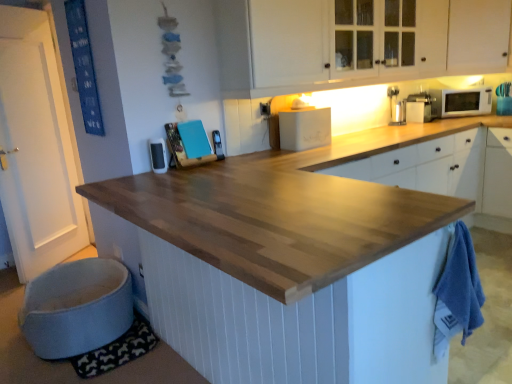
You are a GUI agent. You are given a task and a screenshot of the screen. Output one action in this format:
    pyautogui.click(x=<x>, y=<y>)
    Task: Click on the natural wood countertop at center
    This screenshot has height=384, width=512.
    Given the screenshot: What is the action you would take?
    pyautogui.click(x=286, y=264)

This screenshot has height=384, width=512. Identify the location of white matte cabinet at upper right, which is the first cabinetry in right-to-left order. (478, 36).

This screenshot has width=512, height=384. Describe the element at coordinates (478, 36) in the screenshot. I see `white matte cabinet at upper right, which is the first cabinetry in right-to-left order` at that location.

The height and width of the screenshot is (384, 512). Describe the element at coordinates (305, 128) in the screenshot. I see `white matte breadbox at upper center, marked as the 3th appliance in a left-to-right arrangement` at that location.

The height and width of the screenshot is (384, 512). In order to click on white glossy microwave at upper center, which ranks as the fourth appliance in back-to-front order in this screenshot , I will do `click(158, 155)`.

Measure the distance between point (165, 146) and camera.

Point (165, 146) is 7.57 feet from camera.

I want to click on white glossy microwave at upper right, so click(x=460, y=102).

Is white matte cabinet at upper right, which appears as the second cabinetry when viewed from the left, wider than natural wood countertop at center?

No.

How far apart are white matte cabinet at upper right, which is the first cabinetry in right-to-left order, and natural wood countertop at center?

white matte cabinet at upper right, which is the first cabinetry in right-to-left order, and natural wood countertop at center are 6.78 feet apart from each other.

Is white matte cabinet at upper right, which is the first cabinetry in right-to-left order, positioned with its back to natural wood countertop at center?

No.

From the image's perspective, is white matte cabinet at upper right, which is the first cabinetry in right-to-left order, on top of natural wood countertop at center?

Yes, from the image's perspective, white matte cabinet at upper right, which is the first cabinetry in right-to-left order, is above natural wood countertop at center.

Based on the photo, is metallic silver phone at center, the 2th appliance positioned from the front, oriented away from white glossy microwave at upper center, which is counted as the fourth appliance, starting from the right?

No.

From a real-world perspective, which is physically below, metallic silver phone at center, which is the 3th appliance from right to left, or white glossy microwave at upper center, the first appliance in the left-to-right sequence?

In real-world perspective, metallic silver phone at center, which is the 3th appliance from right to left, is lower.

Considering the relative sizes of metallic silver phone at center, the 2th appliance positioned from the front, and white glossy microwave at upper center, which is counted as the fourth appliance, starting from the right, in the image provided, is metallic silver phone at center, the 2th appliance positioned from the front, wider than white glossy microwave at upper center, which is counted as the fourth appliance, starting from the right,?

Yes, metallic silver phone at center, the 2th appliance positioned from the front, is wider than white glossy microwave at upper center, which is counted as the fourth appliance, starting from the right.

Which of these two, metallic silver phone at center, which is the 3th appliance from right to left, or white glossy microwave at upper center, the first appliance in the left-to-right sequence, stands taller?

white glossy microwave at upper center, the first appliance in the left-to-right sequence.

At what (x,y) coordinates should I click in order to perform the action: click on microwave oven located above the white glossy microwave at upper right, which is the first appliance in right-to-left order (from a real-world perspective). Please return your answer as a coordinate pair (x, y). Looking at the image, I should click on (460, 102).

Is white glossy microwave at upper right in contact with white glossy microwave at upper right, the fourth appliance viewed from the front?

white glossy microwave at upper right is not next to white glossy microwave at upper right, the fourth appliance viewed from the front, and they're not touching.

Between white glossy microwave at upper right and white glossy microwave at upper right, marked as the 4th appliance in a left-to-right arrangement, which one appears on the right side from the viewer's perspective?

white glossy microwave at upper right.

Could you tell me if white wood cabinets at upper center, which ranks as the second cabinetry in right-to-left order, is turned towards white matte breadbox at upper center, which is the 3th appliance in front-to-back order?

No, white wood cabinets at upper center, which ranks as the second cabinetry in right-to-left order, is not facing towards white matte breadbox at upper center, which is the 3th appliance in front-to-back order.

From a real-world perspective, is white wood cabinets at upper center, which ranks as the second cabinetry in right-to-left order, located higher than white matte breadbox at upper center, marked as the 3th appliance in a left-to-right arrangement?

Yes, from a real-world perspective, white wood cabinets at upper center, which ranks as the second cabinetry in right-to-left order, is on top of white matte breadbox at upper center, marked as the 3th appliance in a left-to-right arrangement.

Is white wood cabinets at upper center, which ranks as the second cabinetry in right-to-left order, far away from white matte breadbox at upper center, which is counted as the second appliance, starting from the back?

No, white wood cabinets at upper center, which ranks as the second cabinetry in right-to-left order, is not far away from white matte breadbox at upper center, which is counted as the second appliance, starting from the back.

Considering the sizes of objects white wood cabinets at upper center, which ranks as the second cabinetry in right-to-left order, and white matte breadbox at upper center, marked as the 3th appliance in a left-to-right arrangement, in the image provided, who is wider, white wood cabinets at upper center, which ranks as the second cabinetry in right-to-left order, or white matte breadbox at upper center, marked as the 3th appliance in a left-to-right arrangement,?

white wood cabinets at upper center, which ranks as the second cabinetry in right-to-left order.

Who is bigger, white glossy microwave at upper right, marked as the 4th appliance in a left-to-right arrangement, or white glossy microwave at upper center, which is counted as the fourth appliance, starting from the right?

white glossy microwave at upper right, marked as the 4th appliance in a left-to-right arrangement, is bigger.

From a real-world perspective, which appliance is the 2nd one underneath the white glossy microwave at upper right, which is the first appliance in right-to-left order? Please provide its 2D coordinates.

[(158, 155)]

In the image, is white glossy microwave at upper right, marked as the 4th appliance in a left-to-right arrangement, positioned in front of or behind white glossy microwave at upper center, which is counted as the fourth appliance, starting from the right?

white glossy microwave at upper right, marked as the 4th appliance in a left-to-right arrangement, is behind white glossy microwave at upper center, which is counted as the fourth appliance, starting from the right.

Which of these two, white wood cabinets at upper center, which ranks as the second cabinetry in right-to-left order, or white matte cabinet at upper right, which appears as the second cabinetry when viewed from the left, is thinner?

white matte cabinet at upper right, which appears as the second cabinetry when viewed from the left, is thinner.

Is white wood cabinets at upper center, which appears as the first cabinetry when viewed from the left, outside of white matte cabinet at upper right, which is the first cabinetry in right-to-left order?

Absolutely, white wood cabinets at upper center, which appears as the first cabinetry when viewed from the left, is external to white matte cabinet at upper right, which is the first cabinetry in right-to-left order.

From the image's perspective, is white wood cabinets at upper center, which ranks as the second cabinetry in right-to-left order, positioned above or below white matte cabinet at upper right, which is the first cabinetry in right-to-left order?

white wood cabinets at upper center, which ranks as the second cabinetry in right-to-left order, is situated lower than white matte cabinet at upper right, which is the first cabinetry in right-to-left order, in the image.

This screenshot has height=384, width=512. Identify the location of cabinetry in front of the white matte cabinet at upper right, which is the first cabinetry in right-to-left order. (334, 44).

What's the angular difference between white matte breadbox at upper center, the second appliance from the right, and metallic silver phone at center, the second appliance from the left,'s facing directions?

white matte breadbox at upper center, the second appliance from the right, and metallic silver phone at center, the second appliance from the left, are facing 91.1 degrees away from each other.

From a real-world perspective, is white matte breadbox at upper center, the second appliance from the right, over metallic silver phone at center, the 2th appliance positioned from the front?

Yes.

Which object is closer to the camera taking this photo, white matte breadbox at upper center, marked as the 3th appliance in a left-to-right arrangement, or metallic silver phone at center, the 2th appliance positioned from the front?

metallic silver phone at center, the 2th appliance positioned from the front, is in front.

Find the location of a particular element. Image resolution: width=512 pixels, height=384 pixels. countertop on the left of white matte cabinet at upper right, which is the first cabinetry in right-to-left order is located at coordinates click(x=286, y=264).

Starting from the white glossy microwave at upper center, which is counted as the fourth appliance, starting from the right, which appliance is the 1st one behind? Please provide its 2D coordinates.

[(217, 145)]

Looking at the image, which one is located closer to white glossy exhaust hood at upper center, white wood cabinets at upper center, which ranks as the second cabinetry in right-to-left order, or white glossy microwave at upper right?

white glossy microwave at upper right is closer to white glossy exhaust hood at upper center.

Which object lies further to the anchor point natural wood countertop at center, white matte cabinet at upper right, which appears as the second cabinetry when viewed from the left, or metallic silver phone at center, which is the 3th appliance from right to left?

white matte cabinet at upper right, which appears as the second cabinetry when viewed from the left, is further to natural wood countertop at center.

When comparing their distances from white matte breadbox at upper center, the second appliance from the right, does metallic silver phone at center, which is the 3th appliance from right to left, or white glossy exhaust hood at upper center seem closer?

metallic silver phone at center, which is the 3th appliance from right to left, lies closer to white matte breadbox at upper center, the second appliance from the right, than the other object.

Which object lies nearer to the anchor point white wood cabinets at upper center, which ranks as the second cabinetry in right-to-left order, white glossy microwave at upper center, which ranks as the fourth appliance in back-to-front order, or white glossy microwave at upper right?

Among the two, white glossy microwave at upper right is located nearer to white wood cabinets at upper center, which ranks as the second cabinetry in right-to-left order.

From the image, which object appears to be farther from white glossy exhaust hood at upper center, white wood cabinets at upper center, which appears as the first cabinetry when viewed from the left, or metallic silver phone at center, which is counted as the 3th appliance, starting from the back?

A: Based on the image, metallic silver phone at center, which is counted as the 3th appliance, starting from the back, appears to be further to white glossy exhaust hood at upper center.

From the picture: Based on their spatial positions, is white wood cabinets at upper center, which appears as the first cabinetry when viewed from the left, or white matte cabinet at upper right, which appears as the second cabinetry when viewed from the left, closer to white matte breadbox at upper center, marked as the 3th appliance in a left-to-right arrangement?

white wood cabinets at upper center, which appears as the first cabinetry when viewed from the left.

Based on their spatial positions, is metallic silver phone at center, which is the 3th appliance from right to left, or white glossy microwave at upper right further from white matte cabinet at upper right, which appears as the second cabinetry when viewed from the left?

The object further to white matte cabinet at upper right, which appears as the second cabinetry when viewed from the left, is metallic silver phone at center, which is the 3th appliance from right to left.

In the scene shown: From the image, which object appears to be nearer to white wood cabinets at upper center, which ranks as the second cabinetry in right-to-left order, metallic silver phone at center, the 2th appliance positioned from the front, or white matte breadbox at upper center, which is counted as the second appliance, starting from the back?

Based on the image, white matte breadbox at upper center, which is counted as the second appliance, starting from the back, appears to be nearer to white wood cabinets at upper center, which ranks as the second cabinetry in right-to-left order.

The width and height of the screenshot is (512, 384). What are the coordinates of `exhaust hood positioned between natural wood countertop at center and white glossy microwave at upper right from near to far` in the screenshot? It's located at (462, 81).

Where is `cabinetry between white wood cabinets at upper center, which ranks as the second cabinetry in right-to-left order, and white glossy exhaust hood at upper center, along the z-axis`? The height and width of the screenshot is (384, 512). cabinetry between white wood cabinets at upper center, which ranks as the second cabinetry in right-to-left order, and white glossy exhaust hood at upper center, along the z-axis is located at coordinates (478, 36).

At what (x,y) coordinates should I click in order to perform the action: click on exhaust hood between white glossy microwave at upper center, which is counted as the 1th appliance, starting from the front, and white glossy microwave at upper right, in the horizontal direction. Please return your answer as a coordinate pair (x, y). Looking at the image, I should click on (462, 81).

What are the coordinates of `exhaust hood positioned between white wood cabinets at upper center, which appears as the first cabinetry when viewed from the left, and white glossy microwave at upper right from near to far` in the screenshot? It's located at (462, 81).